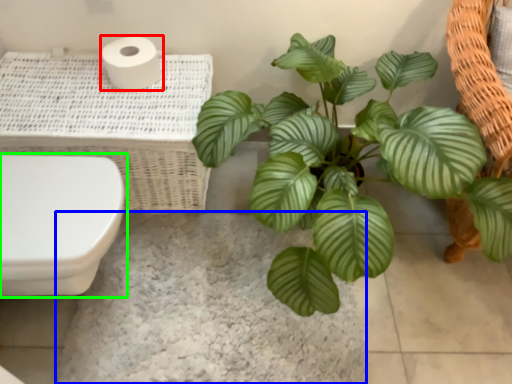
Question: Which object is positioned closest to toilet paper (highlighted by a red box)? Select from concrete (highlighted by a blue box) and toilet (highlighted by a green box).

Choices:
 (A) concrete
 (B) toilet

Answer: (B)